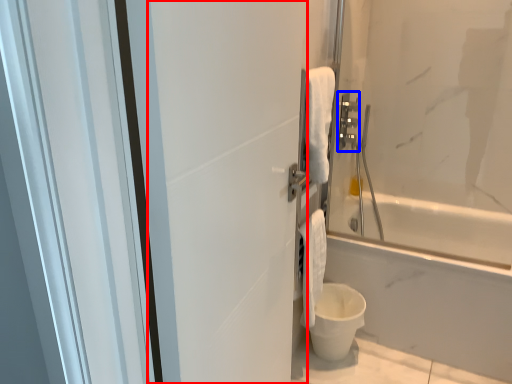
Question: Which object appears closest to the camera in this image, screen door (highlighted by a red box) or towel bar (highlighted by a blue box)?

Choices:
 (A) screen door
 (B) towel bar

Answer: (A)